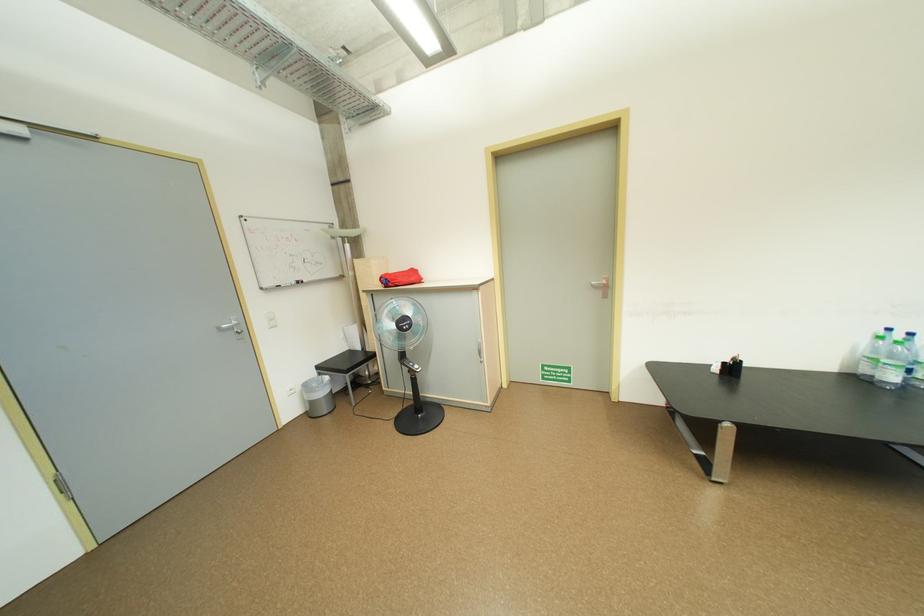
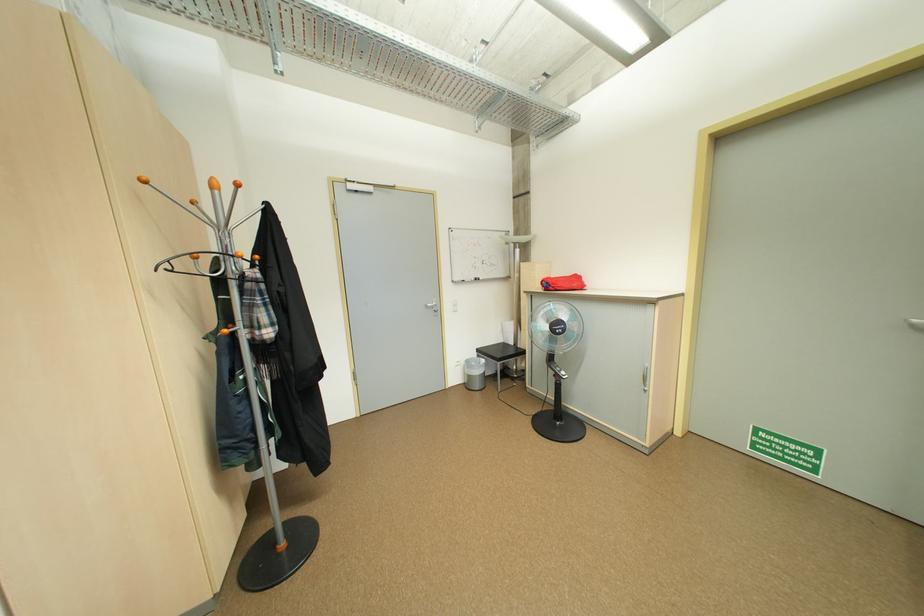
Locate, in the second image, the point that corresponds to the point at 228,330 in the first image.

(435, 307)